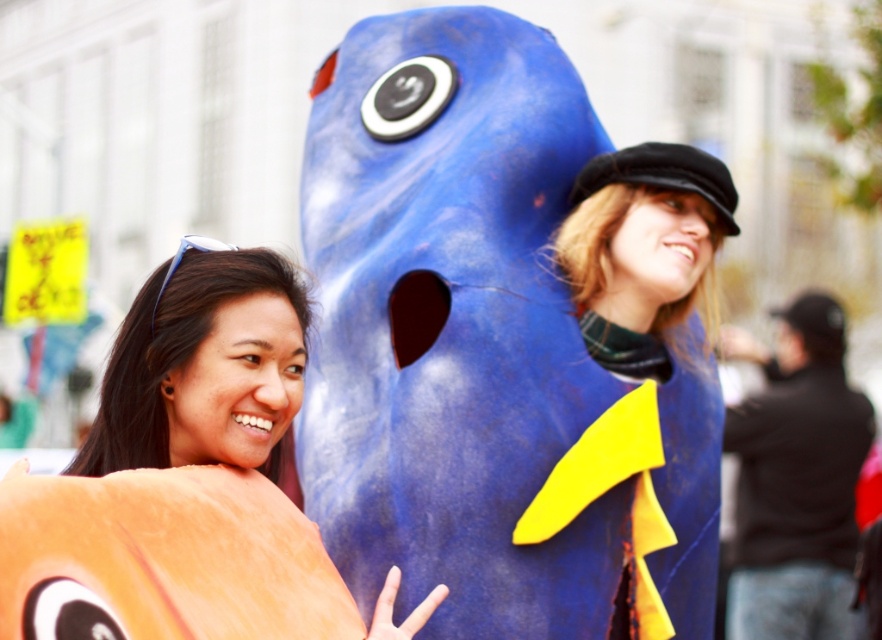
You are a photographer trying to capture a photo of the matte orange plush at left and the matte blue costume at center. Since you want both subjects to appear proportionally sized in the frame, which subject should you move closer to the camera?

The matte orange plush at left is much taller than the matte blue costume at center, so to make them appear proportionally sized in the frame, you should move the matte blue costume at center closer to the camera.

You are a photographer setting up a shoot in this scene. You want to place a new prop on the ground in front of the matte blue costume at center so that it doesn not block the view of the matte orange plush at left. Where should you place the prop?

The matte orange plush at left is positioned under the matte blue costume at center. To avoid blocking its view, place the prop in front of the matte blue costume at center but closer to the front edge, ensuring it doesn not extend under where the matte orange plush at left is located.